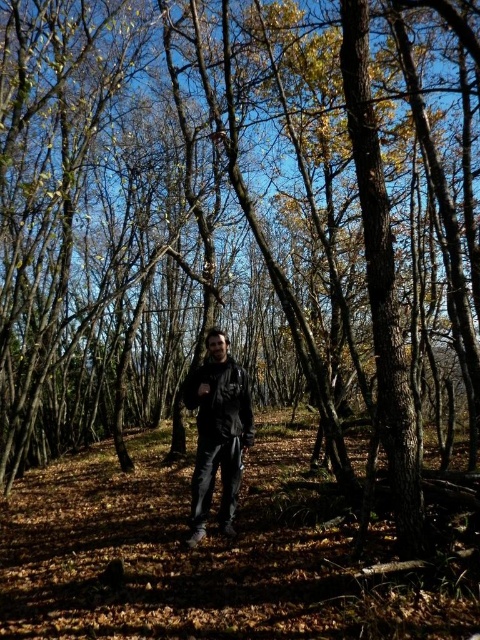
In the scene shown: You are a hiker trying to decide which jacket to take from your backpack. You see both the matte black jacket at center and the leather jacket at center in your inventory. Which jacket is more accessible to you right now?

The matte black jacket at center is more accessible because it is closer to the viewer than the leather jacket at center.

You are a hiker trying to decide which jacket to take with you for a chilly autumn hike. You notice the matte black jacket at center and the leather jacket at center in the forest scene. Based on their positions, which jacket is closer to you?

The matte black jacket at center and leather jacket at center are 7.96 inches apart from each other, so it depends on which direction you are facing. However, since both jackets are at the center, they are equally close to you.